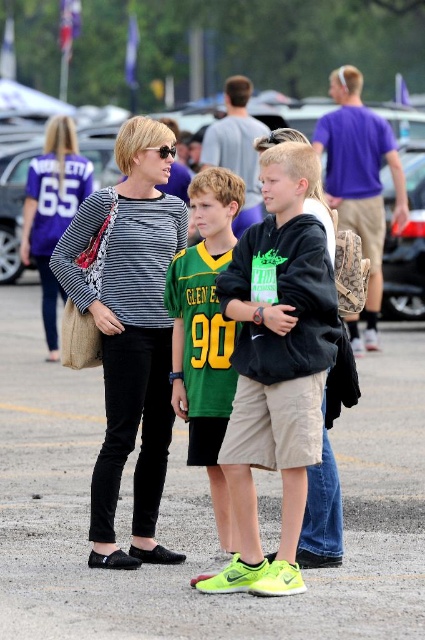
You are a photographer trying to capture a candid shot of the matte black backpack at center and the matte black striped shirt at center. From your current position, which one is to the right?

The matte black backpack at center is positioned on the right side of the matte black striped shirt at center, so the matte black backpack at center is to the right.

You are standing at point (34, 228) and want to walk to point (161, 547). Are you facing the correct direction to reach your destination?

Yes, since point (161, 547) is in front of point (34, 228), you are facing the correct direction to reach your destination.